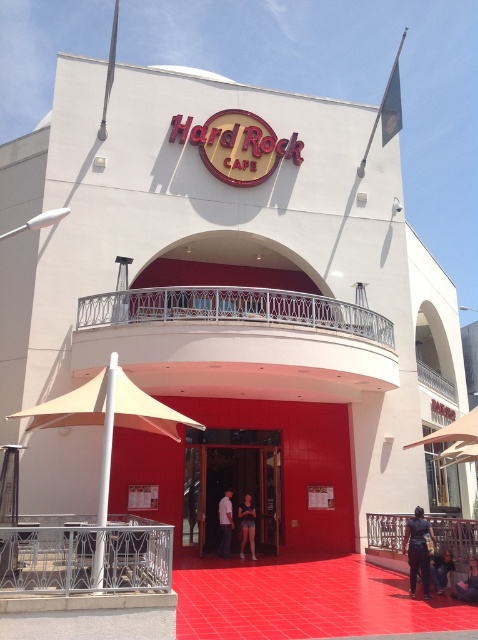
Question: Which object is closer to the camera taking this photo?

Choices:
 (A) smooth glass door at center
 (B) dark blue shirt at lower right

Answer: (B)

Question: Which point is farther from the camera taking this photo?

Choices:
 (A) tap(432, 532)
 (B) tap(226, 554)

Answer: (B)

Question: Does white cotton shirt at center appear on the right side of denim shorts at center?

Choices:
 (A) no
 (B) yes

Answer: (A)

Question: Is the position of smooth glass door at center more distant than that of matte black shorts at center?

Choices:
 (A) yes
 (B) no

Answer: (A)

Question: Does smooth glass door at center appear on the right side of denim shorts at center?

Choices:
 (A) no
 (B) yes

Answer: (A)

Question: Which point is closer to the camera?

Choices:
 (A) smooth glass door at center
 (B) matte black shorts at center

Answer: (B)